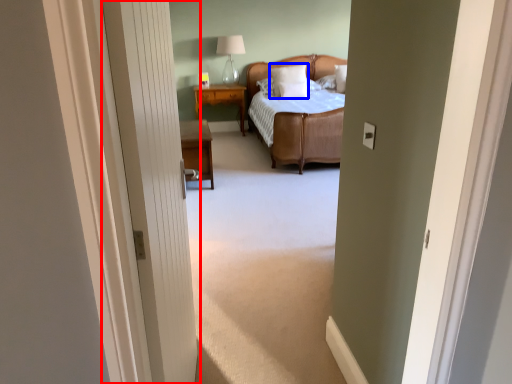
Question: Which point is further to the camera, door (highlighted by a red box) or pillow (highlighted by a blue box)?

Choices:
 (A) door
 (B) pillow

Answer: (B)